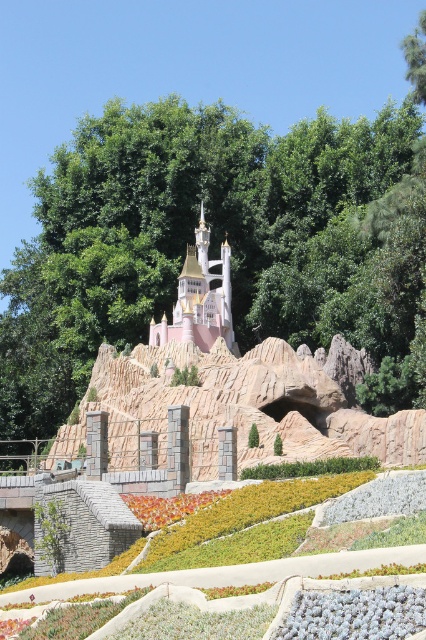
Is pastel pink stone castle at center behind vibrant orange petals at center?

Yes, it is.

Which is behind, point (213, 323) or point (155, 499)?

Point (213, 323)

What do you see at coordinates (199, 298) in the screenshot?
I see `pastel pink stone castle at center` at bounding box center [199, 298].

This screenshot has height=640, width=426. Identify the location of pastel pink stone castle at center. (199, 298).